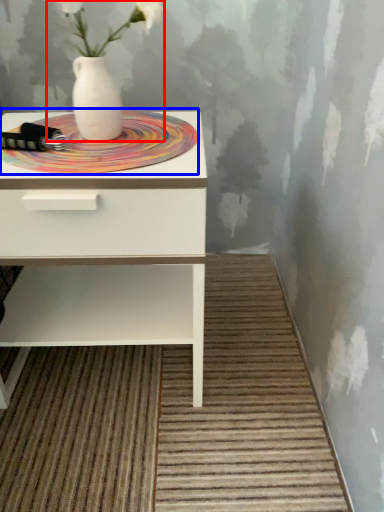
Question: Which object is further to the camera taking this photo, floral arrangement (highlighted by a red box) or mat (highlighted by a blue box)?

Choices:
 (A) floral arrangement
 (B) mat

Answer: (B)